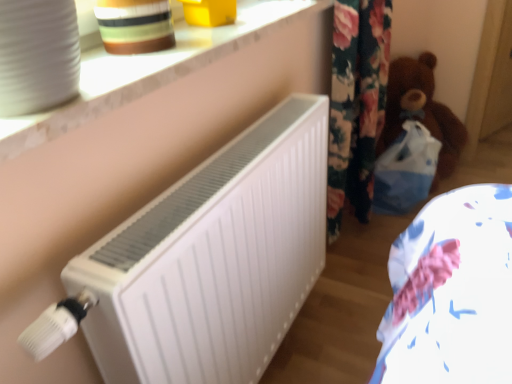
Question: Does striped ceramic pot at upper left touch brown plush teddy bear at right?

Choices:
 (A) no
 (B) yes

Answer: (A)

Question: Is striped ceramic pot at upper left facing towards brown plush teddy bear at right?

Choices:
 (A) yes
 (B) no

Answer: (B)

Question: Is striped ceramic pot at upper left behind brown plush teddy bear at right?

Choices:
 (A) yes
 (B) no

Answer: (B)

Question: From a real-world perspective, is striped ceramic pot at upper left located higher than brown plush teddy bear at right?

Choices:
 (A) yes
 (B) no

Answer: (A)

Question: Can you confirm if striped ceramic pot at upper left is positioned to the left of brown plush teddy bear at right?

Choices:
 (A) no
 (B) yes

Answer: (B)

Question: Is striped ceramic pot at upper left positioned with its back to brown plush teddy bear at right?

Choices:
 (A) no
 (B) yes

Answer: (A)

Question: Can you confirm if white matte radiator at center is thinner than white marble window sill at upper center?

Choices:
 (A) no
 (B) yes

Answer: (B)

Question: Can you confirm if white matte radiator at center is bigger than white marble window sill at upper center?

Choices:
 (A) yes
 (B) no

Answer: (A)

Question: Is white marble window sill at upper center inside white matte radiator at center?

Choices:
 (A) no
 (B) yes

Answer: (A)

Question: Is white matte radiator at center in front of white marble window sill at upper center?

Choices:
 (A) yes
 (B) no

Answer: (B)

Question: Does white matte radiator at center touch white marble window sill at upper center?

Choices:
 (A) no
 (B) yes

Answer: (A)

Question: From the image's perspective, is white matte radiator at center located above white marble window sill at upper center?

Choices:
 (A) no
 (B) yes

Answer: (A)

Question: Is white matte radiator at center a part of striped ceramic pot at upper left?

Choices:
 (A) yes
 (B) no

Answer: (B)